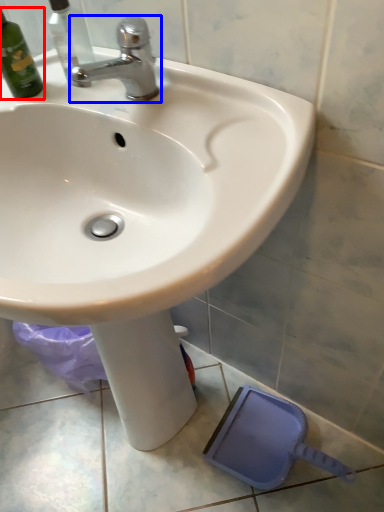
Question: Which object appears closest to the camera in this image, bottle (highlighted by a red box) or tap (highlighted by a blue box)?

Choices:
 (A) bottle
 (B) tap

Answer: (B)